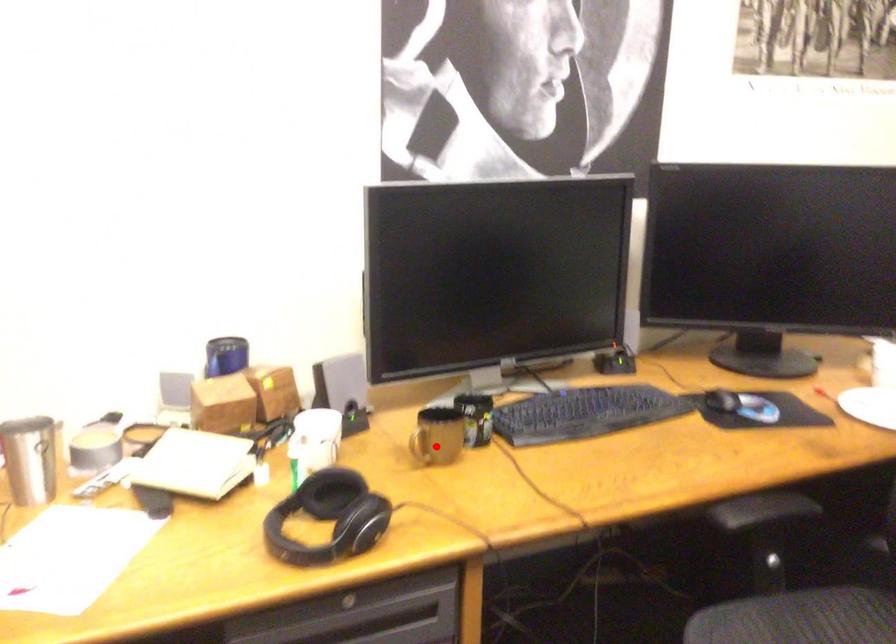
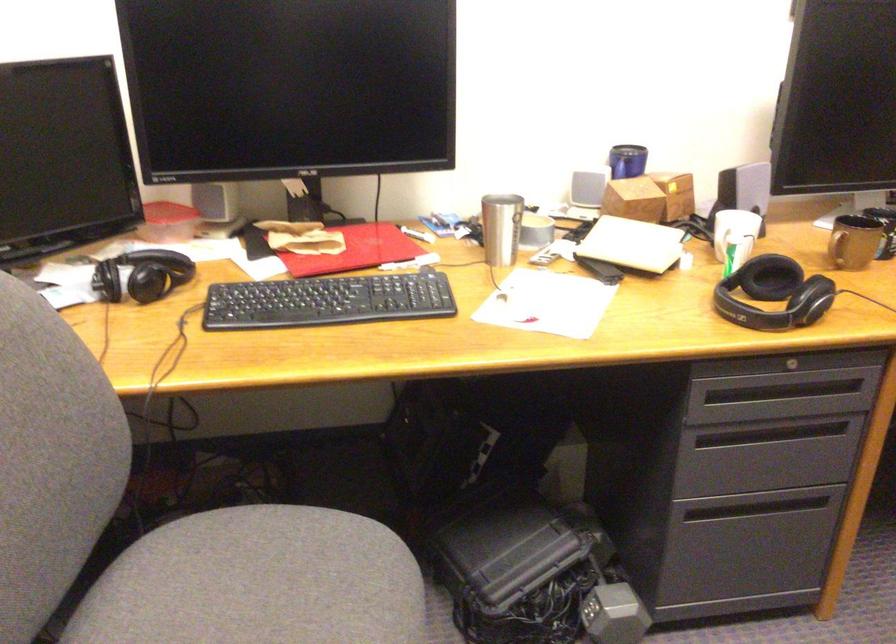
Where in the second image is the point corresponding to the highlighted location from the first image?

(854, 242)